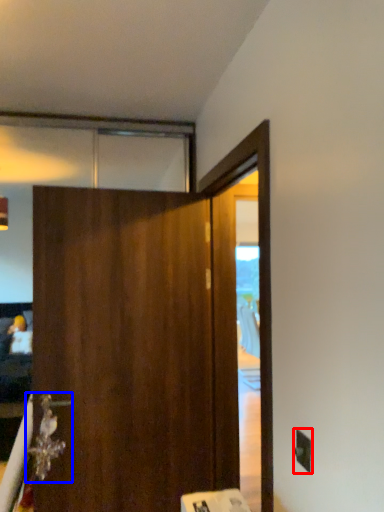
Question: Which object is closer to the camera taking this photo, electric outlet (highlighted by a red box) or door handle (highlighted by a blue box)?

Choices:
 (A) electric outlet
 (B) door handle

Answer: (A)